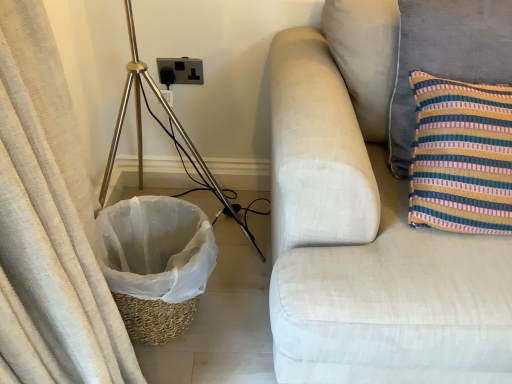
Question: Considering the relative sizes of gold metallic tripod at left and light beige fabric couch at right in the image provided, is gold metallic tripod at left bigger than light beige fabric couch at right?

Choices:
 (A) yes
 (B) no

Answer: (B)

Question: Is gold metallic tripod at left further to the viewer compared to light beige fabric couch at right?

Choices:
 (A) yes
 (B) no

Answer: (A)

Question: Is gold metallic tripod at left shorter than light beige fabric couch at right?

Choices:
 (A) yes
 (B) no

Answer: (A)

Question: Does gold metallic tripod at left have a greater width compared to light beige fabric couch at right?

Choices:
 (A) yes
 (B) no

Answer: (B)

Question: Is light beige fabric couch at right at the back of gold metallic tripod at left?

Choices:
 (A) yes
 (B) no

Answer: (B)

Question: In terms of width, does light beige fabric couch at right look wider or thinner when compared to gold metallic tripod at left?

Choices:
 (A) wide
 (B) thin

Answer: (A)

Question: In terms of height, does light beige fabric couch at right look taller or shorter compared to gold metallic tripod at left?

Choices:
 (A) short
 (B) tall

Answer: (B)

Question: Is light beige fabric couch at right bigger or smaller than gold metallic tripod at left?

Choices:
 (A) small
 (B) big

Answer: (B)

Question: From the image's perspective, is light beige fabric couch at right positioned above or below gold metallic tripod at left?

Choices:
 (A) above
 (B) below

Answer: (B)

Question: From a real-world perspective, relative to gold metallic tripod at left, is black plastic outlet at center vertically above or below?

Choices:
 (A) below
 (B) above

Answer: (B)

Question: Is black plastic outlet at center bigger or smaller than gold metallic tripod at left?

Choices:
 (A) small
 (B) big

Answer: (A)

Question: In the image, is black plastic outlet at center positioned in front of or behind gold metallic tripod at left?

Choices:
 (A) behind
 (B) front

Answer: (A)

Question: Looking at their shapes, would you say black plastic outlet at center is wider or thinner than gold metallic tripod at left?

Choices:
 (A) thin
 (B) wide

Answer: (A)

Question: Considering the positions of striped fabric pillow at right and black plastic outlet at center in the image, is striped fabric pillow at right bigger or smaller than black plastic outlet at center?

Choices:
 (A) big
 (B) small

Answer: (A)

Question: From a real-world perspective, is striped fabric pillow at right positioned above or below black plastic outlet at center?

Choices:
 (A) above
 (B) below

Answer: (A)